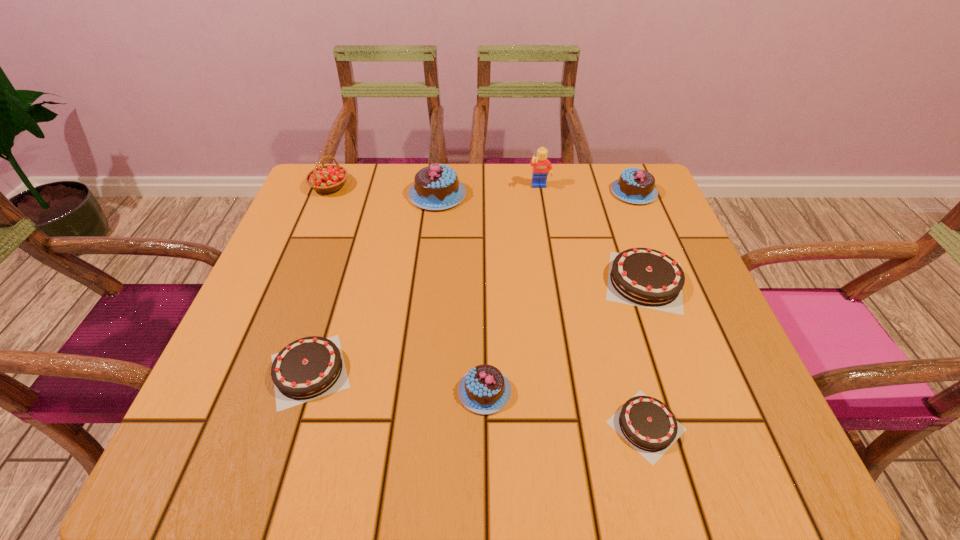
The height and width of the screenshot is (540, 960). In order to click on vacant area that lies between the second smallest pink chocolate cake and the yellow Lego in this screenshot , I will do click(x=587, y=190).

This screenshot has height=540, width=960. I want to click on free space between the fourth nearest object and the smallest pink chocolate cake, so click(x=564, y=336).

Identify the location of vacant area between the nearest pink chocolate cake and the strawberry. This screenshot has width=960, height=540. (407, 289).

Image resolution: width=960 pixels, height=540 pixels. I want to click on vacant area that lies between the fifth farthest object and the nearest pink chocolate cake, so (x=564, y=336).

Find the location of `free space between the leftmost chocolate cake and the brown strawberry`. free space between the leftmost chocolate cake and the brown strawberry is located at coordinates (320, 279).

The height and width of the screenshot is (540, 960). I want to click on object that can be found as the second closest to the second biggest brown chocolate cake, so click(x=436, y=187).

This screenshot has width=960, height=540. In order to click on object that is the seventh closest to the nearest pink chocolate cake in this screenshot , I will do `click(329, 178)`.

The image size is (960, 540). What are the coordinates of `chocolate cake that is the closest one to the brown strawberry` in the screenshot? It's located at (436, 187).

Locate which chocolate cake is the closest to the yellow Lego. Please provide its 2D coordinates. Your answer should be formatted as a tuple, i.e. [(x, y)], where the tuple contains the x and y coordinates of a point satisfying the conditions above.

[(637, 186)]

Identify which pink chocolate cake is the second closest to the fourth nearest chocolate cake. Please provide its 2D coordinates. Your answer should be formatted as a tuple, i.e. [(x, y)], where the tuple contains the x and y coordinates of a point satisfying the conditions above.

[(484, 389)]